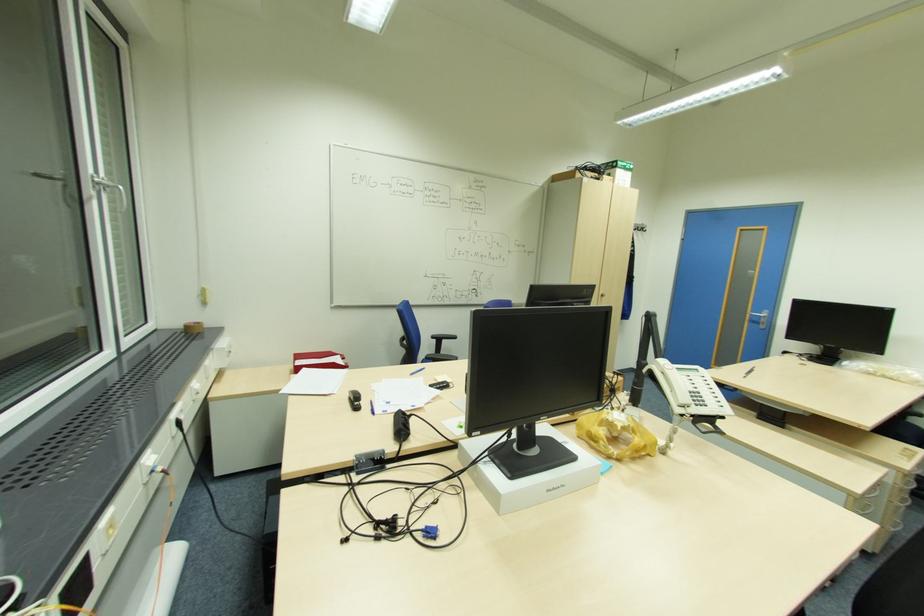
Identify the location of telephone keypad button. The height and width of the screenshot is (616, 924). (697, 398).